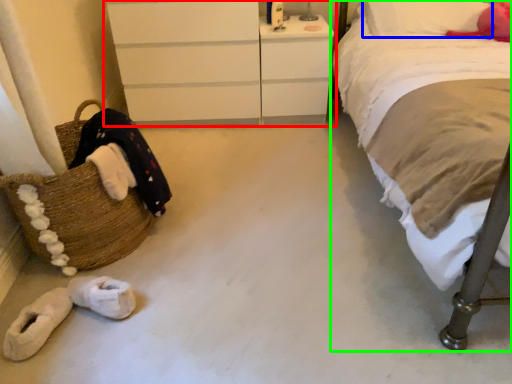
Question: Which is nearer to the chest of drawers (highlighted by a red box)? pillow (highlighted by a blue box) or bed (highlighted by a green box).

Choices:
 (A) pillow
 (B) bed

Answer: (A)